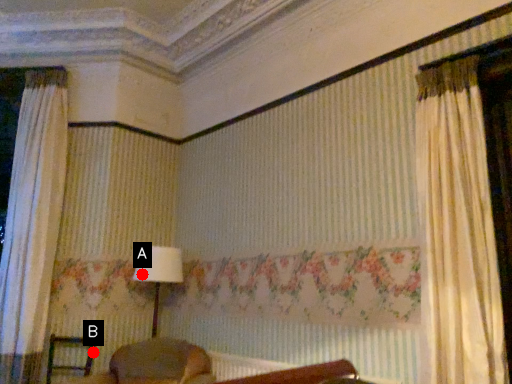
Question: Two points are circled on the image, labeled by A and B beside each circle. Which point is farther from the camera taking this photo?

Choices:
 (A) A is further
 (B) B is further

Answer: (A)